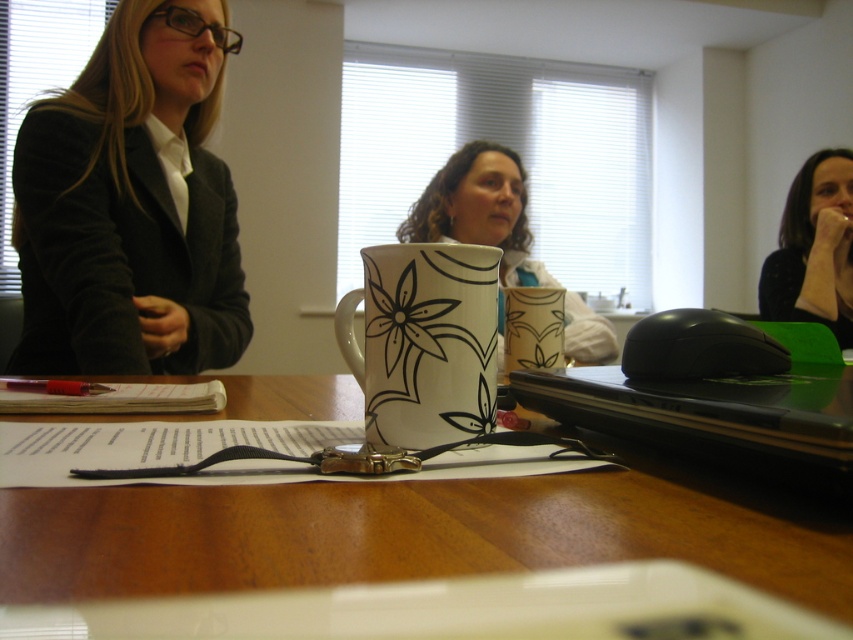
You are organizing a meeting and need to place a name tag for the person wearing the black dotted shirt at upper right. Where should you place it relative to the floral ceramic mug at center?

The floral ceramic mug at center is located below the black dotted shirt at upper right, so the name tag should be placed above the floral ceramic mug at center to be near the black dotted shirt at upper right.

You are standing in front of the table in the meeting room. There are two points marked on the table surface. One is at coordinate point(x=509, y=268) and the other is at point(x=808, y=317). Which point is closer to you?

Point(x=509, y=268) is closer to you because it is further to the viewer than point(x=808, y=317).